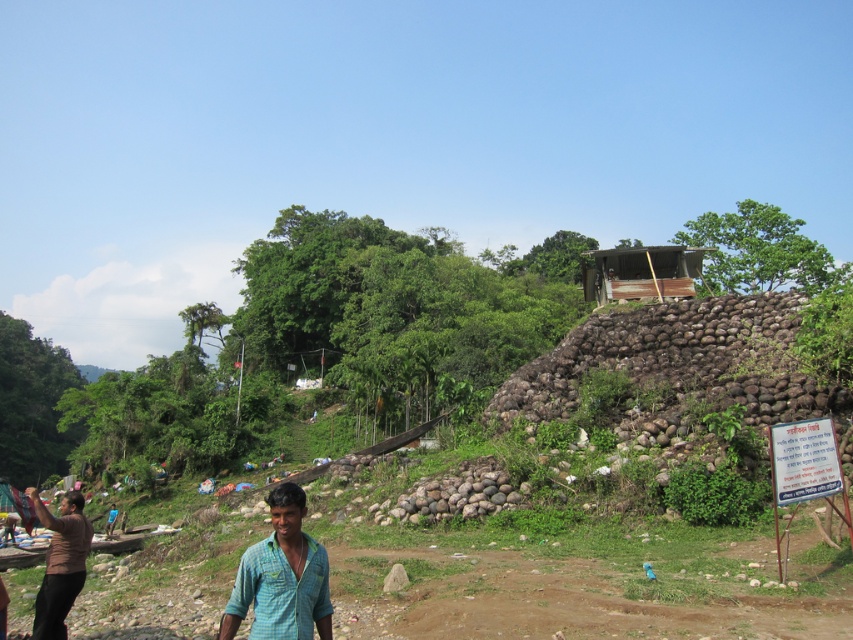
Question: Which of the following is the farthest from the observer?

Choices:
 (A) green checkered shirt at lower center
 (B) brown matte shirt at lower left
 (C) weathered wood hut at upper right

Answer: (C)

Question: Among these points, which one is farthest from the camera?

Choices:
 (A) (612, 266)
 (B) (74, 528)
 (C) (329, 634)

Answer: (A)

Question: Does green checkered shirt at lower center appear on the left side of weathered wood hut at upper right?

Choices:
 (A) yes
 (B) no

Answer: (A)

Question: Based on their relative distances, which object is farther from the weathered wood hut at upper right?

Choices:
 (A) brown matte shirt at lower left
 (B) green checkered shirt at lower center

Answer: (B)

Question: Does weathered wood hut at upper right lie in front of brown matte shirt at lower left?

Choices:
 (A) no
 (B) yes

Answer: (A)

Question: Is green checkered shirt at lower center above brown matte shirt at lower left?

Choices:
 (A) no
 (B) yes

Answer: (B)